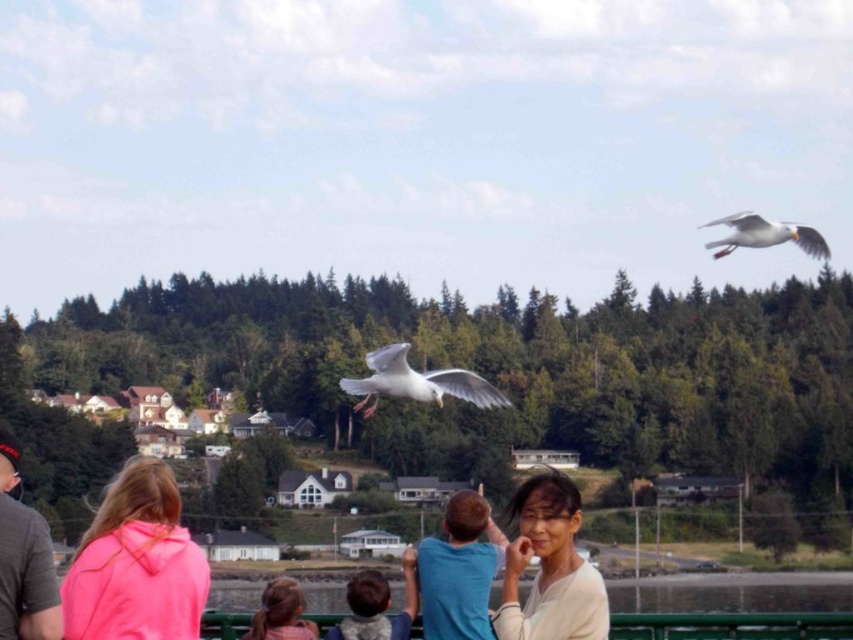
You are a photographer trying to capture the scene. You notice the blue cotton shirt at center and the light brown hair at lower center. Which object should you focus on if you want to capture the larger subject in your shot?

The light brown hair at lower center occupies more space than the blue cotton shirt at center, so focusing on the light brown hair at lower center would capture the larger subject.

You are a photographer trying to capture a clear shot of the seagulls flying to the right. You notice the smooth beige blouse at center and the pink fleece jacket at lower center might block your view. Which clothing item is closer to you and could potentially obstruct the shot?

The smooth beige blouse at center is in front of the pink fleece jacket at lower center, so it is closer to you and could potentially obstruct the shot.